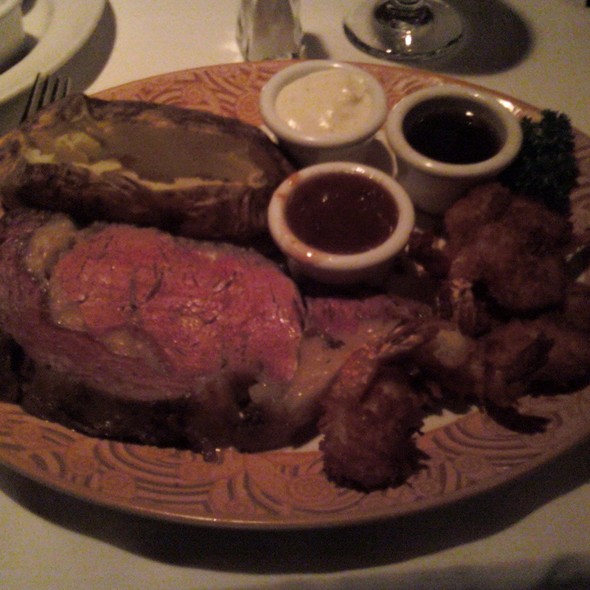
Identify the location of table cloth. This screenshot has height=590, width=590. (103, 553).